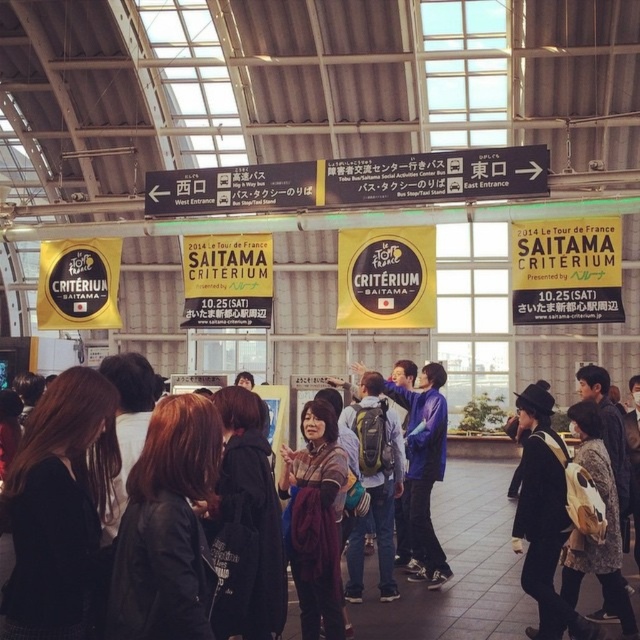
Is point (576, 612) positioned after point (417, 481)?

No.

Which is above, black leather backpack at center or matte blue backpack at center?

black leather backpack at center

Which is behind, point (563, 513) or point (417, 548)?

Point (417, 548)

Find the location of a particular element. black leather backpack at center is located at coordinates (544, 516).

Does maroon fabric scarf at center appear over black leather backpack at center?

Actually, maroon fabric scarf at center is below black leather backpack at center.

In order to click on maroon fabric scarf at center in this screenshot , I will do `click(316, 520)`.

Find the location of `maroon fabric scarf at center`. maroon fabric scarf at center is located at coordinates (316, 520).

Does dark brown leather jacket at lower left have a lesser height compared to black leather jacket at center?

Correct, dark brown leather jacket at lower left is not as tall as black leather jacket at center.

Locate an element on the screen. The width and height of the screenshot is (640, 640). dark brown leather jacket at lower left is located at coordinates (58, 506).